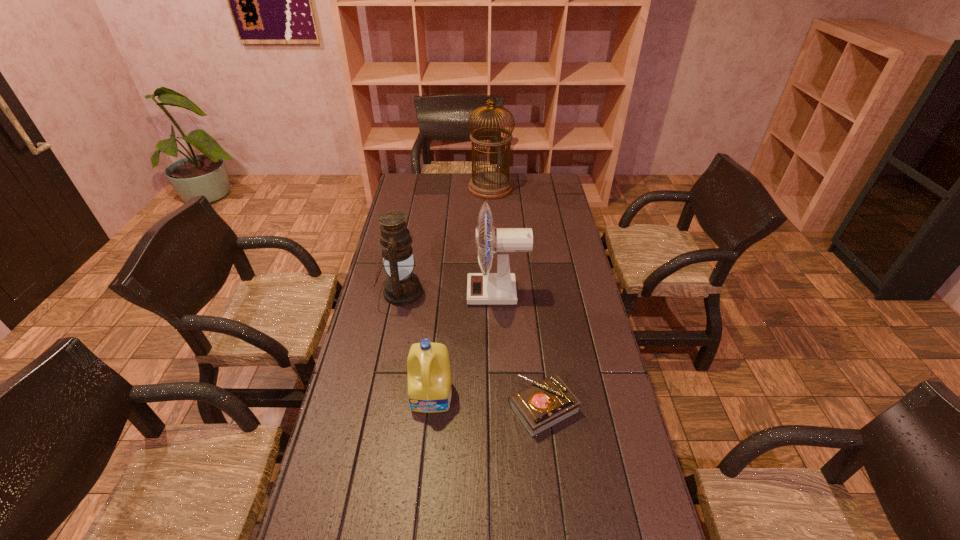
In the image, there is a desktop. Where is `vacant space at the left edge`? vacant space at the left edge is located at coordinates (373, 467).

In the image, there is a desktop. At what (x,y) coordinates should I click in order to perform the action: click on vacant space at the right edge. Please return your answer as a coordinate pair (x, y). Image resolution: width=960 pixels, height=540 pixels. Looking at the image, I should click on (595, 531).

The width and height of the screenshot is (960, 540). Find the location of `free region at the far right corner`. free region at the far right corner is located at coordinates (562, 187).

The height and width of the screenshot is (540, 960). What are the coordinates of `vacant space that's between the fan and the shortest object` in the screenshot? It's located at (520, 350).

I want to click on vacant space that's between the shortest object and the fan, so click(520, 350).

The height and width of the screenshot is (540, 960). In order to click on free point between the farthest object and the leftmost object in this screenshot , I will do `click(445, 240)`.

The image size is (960, 540). In order to click on vacant region between the second shortest object and the fan in this screenshot , I will do `click(465, 345)`.

This screenshot has height=540, width=960. Identify the location of object that can be found as the second closest to the fourth tallest object. (x=485, y=288).

Identify which object is the third closest to the fan. Please provide its 2D coordinates. Your answer should be formatted as a tuple, i.e. [(x, y)], where the tuple contains the x and y coordinates of a point satisfying the conditions above.

[(544, 404)]

Where is `vacant region that satisfies the following two spatial constraints: 1. on the label of the fourth tallest object; 2. on the left side of the shortest object`? This screenshot has height=540, width=960. vacant region that satisfies the following two spatial constraints: 1. on the label of the fourth tallest object; 2. on the left side of the shortest object is located at coordinates (431, 408).